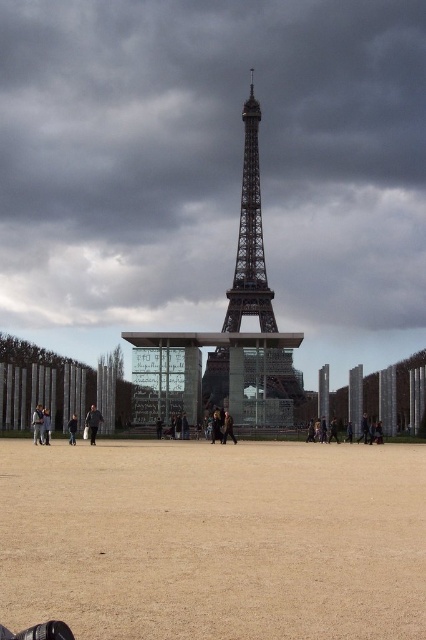
Is dark gray cloudy sky at upper center further to the viewer compared to dark brown leather jacket at center?

Yes, it is.

Is dark gray cloudy sky at upper center closer to the viewer compared to dark brown leather jacket at center?

No, dark gray cloudy sky at upper center is behind dark brown leather jacket at center.

Is point (190, 280) farther from viewer compared to point (69, 428)?

Yes.

The image size is (426, 640). In order to click on dark gray cloudy sky at upper center in this screenshot , I will do `click(210, 157)`.

Which is above, dark gray jacket at center or dark brown leather jacket at center?

dark gray jacket at center is above.

Can you confirm if dark gray jacket at center is bigger than dark brown leather jacket at center?

Yes.

The width and height of the screenshot is (426, 640). I want to click on dark gray jacket at center, so click(x=92, y=422).

Where is `dark gray jacket at center`? This screenshot has width=426, height=640. dark gray jacket at center is located at coordinates (92, 422).

Who is positioned more to the right, metallic structure at center or dark gray jacket at center?

metallic structure at center is more to the right.

Looking at this image, can you confirm if metallic structure at center is positioned below dark gray jacket at center?

Incorrect, metallic structure at center is not positioned below dark gray jacket at center.

Identify the location of metallic structure at center. (250, 236).

Locate an element on the screen. This screenshot has height=640, width=426. metallic structure at center is located at coordinates click(x=250, y=236).